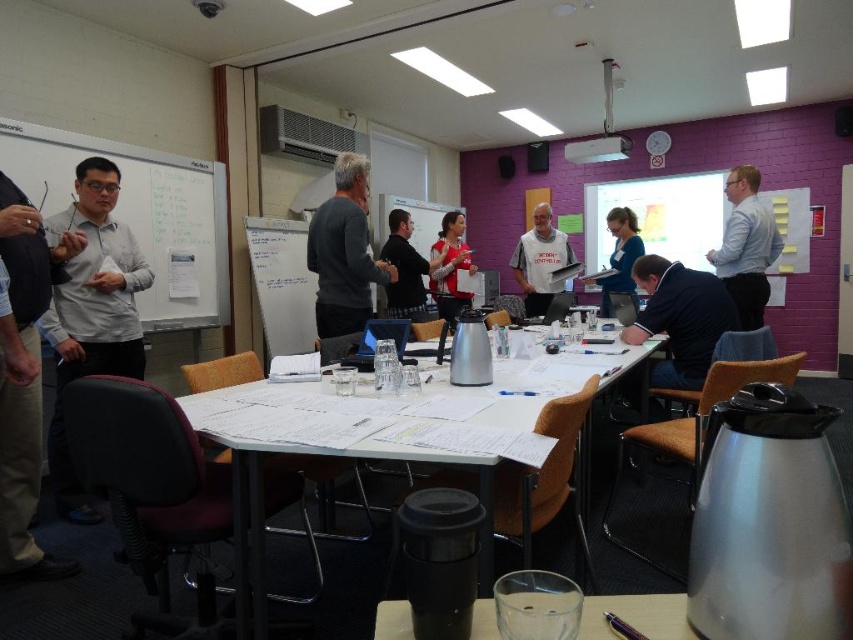
Question: From the image, what is the correct spatial relationship of whiteboard at left in relation to white shirt at left?

Choices:
 (A) above
 (B) below

Answer: (A)

Question: Among these points, which one is nearest to the camera?

Choices:
 (A) coord(363,177)
 (B) coord(616,604)

Answer: (B)

Question: Where is matte gray shirt at left located in relation to black shirt at center in the image?

Choices:
 (A) below
 (B) above

Answer: (A)

Question: Is black shirt at center below blue jersey at center?

Choices:
 (A) yes
 (B) no

Answer: (A)

Question: Estimate the real-world distances between objects in this image. Which object is farther from the white shirt at left?

Choices:
 (A) light blue shirt at center
 (B) blue jersey at center
 (C) dark gray sweater at center

Answer: (B)

Question: Which object appears closest to the camera in this image?

Choices:
 (A) dark blue shirt at center
 (B) black shirt at center

Answer: (A)